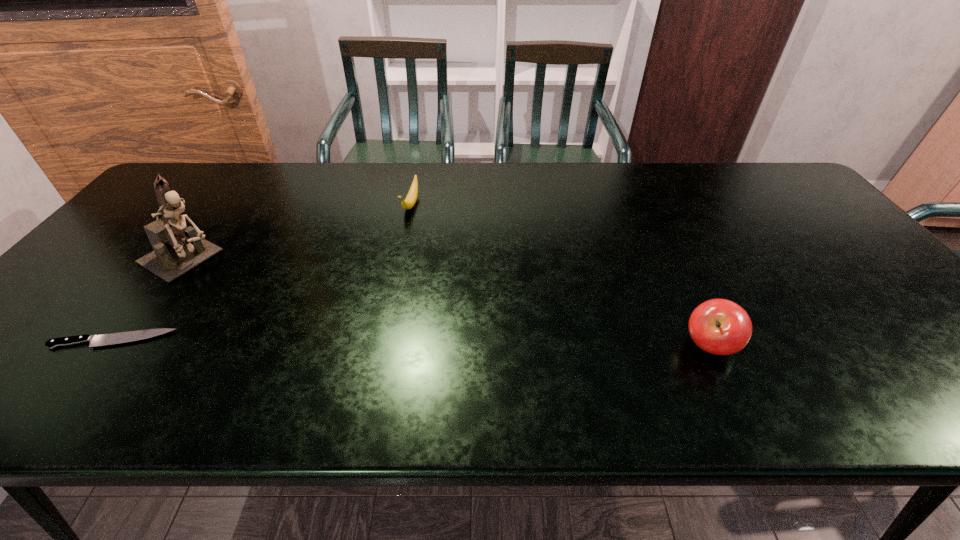
You are a GUI agent. You are given a task and a screenshot of the screen. Output one action in this format:
    pyautogui.click(x=<x>, y=<y>)
    Task: Click on the free location that satisfies the following two spatial constraints: 1. on the front side of the third nearest object; 2. on the stem of the apple
    The height and width of the screenshot is (540, 960).
    Given the screenshot: What is the action you would take?
    pyautogui.click(x=123, y=346)

Locate an element on the screen. Image resolution: width=960 pixels, height=540 pixels. free space that satisfies the following two spatial constraints: 1. on the front side of the shortest object; 2. on the stem of the third shortest object is located at coordinates (108, 346).

What are the coordinates of `vacant area in the image that satisfies the following two spatial constraints: 1. on the back side of the shortest object; 2. on the right side of the second object from right to left` in the screenshot? It's located at (217, 205).

Locate an element on the screen. The image size is (960, 540). vacant space that satisfies the following two spatial constraints: 1. on the front side of the steak knife; 2. on the stem of the rightmost object is located at coordinates (108, 346).

The image size is (960, 540). Identify the location of free spot that satisfies the following two spatial constraints: 1. on the front side of the second tallest object; 2. on the stem of the shortest object. (108, 346).